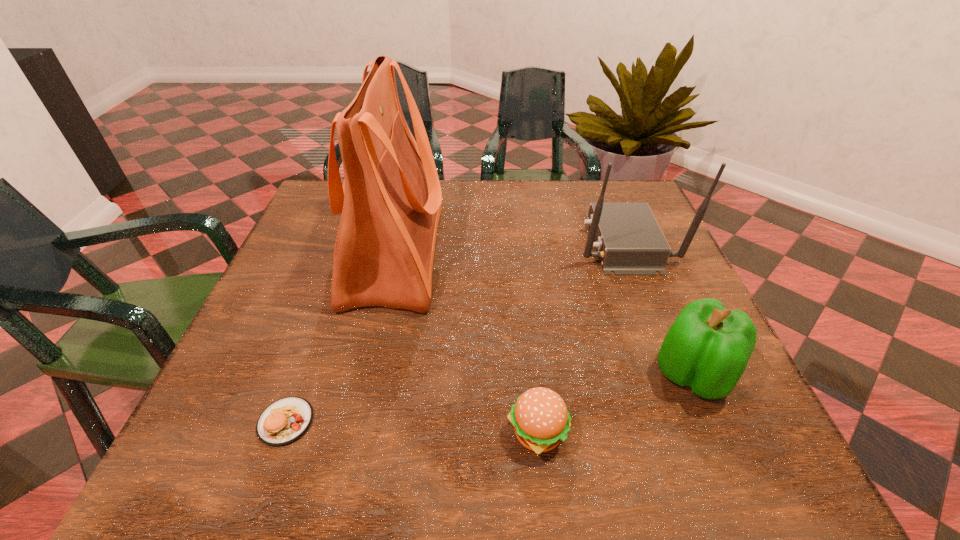
This screenshot has height=540, width=960. Identify the location of blank space that satisfies the following two spatial constraints: 1. on the back side of the second shortest object; 2. on the left side of the third shortest object. (531, 375).